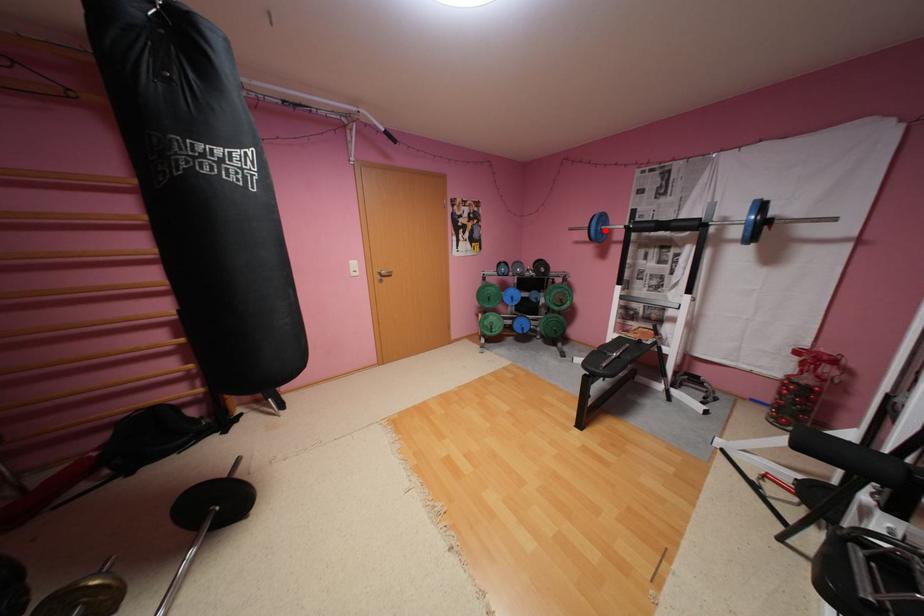
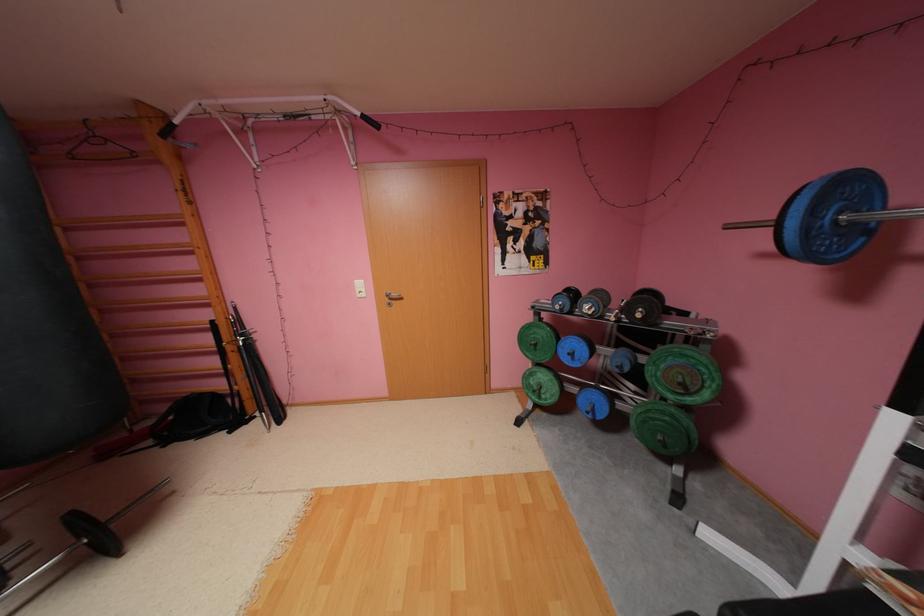
Where in the second image is the point corresponding to the highlighted location from the first image?

(816, 229)